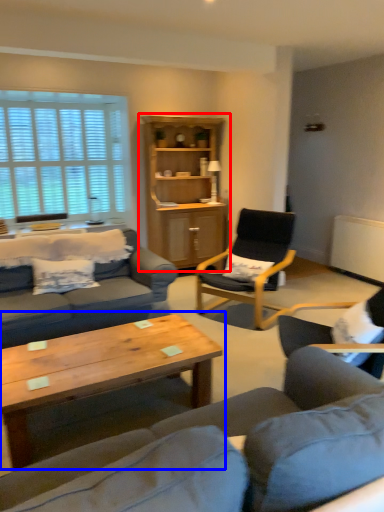
Question: Which of the following is the farthest to the observer, cabinetry (highlighted by a red box) or coffee table (highlighted by a blue box)?

Choices:
 (A) cabinetry
 (B) coffee table

Answer: (A)